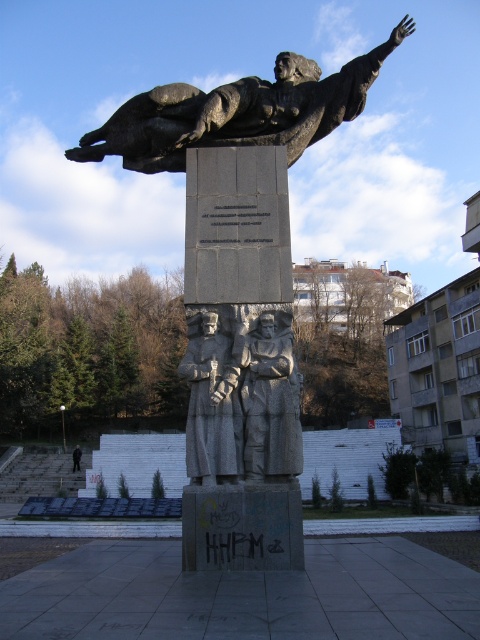
Looking at the monument, where is the bronze statue at center in relation to the gray stone statue at center?

The bronze statue at center is located to the left of the gray stone statue at center.